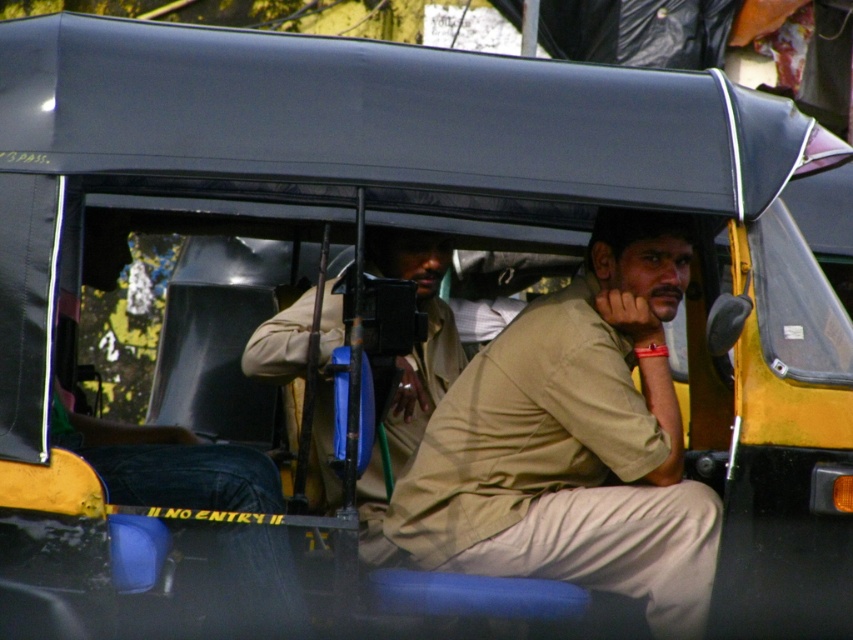
Question: Does beige cotton shirt at center have a larger size compared to khaki uniform at center?

Choices:
 (A) no
 (B) yes

Answer: (A)

Question: Which point is closer to the camera?

Choices:
 (A) (390, 547)
 (B) (608, 337)

Answer: (B)

Question: Does beige cotton shirt at center appear under khaki uniform at center?

Choices:
 (A) no
 (B) yes

Answer: (B)

Question: Which object is closer to the camera taking this photo?

Choices:
 (A) beige cotton shirt at center
 (B) khaki uniform at center

Answer: (A)

Question: Is beige cotton shirt at center wider than khaki uniform at center?

Choices:
 (A) no
 (B) yes

Answer: (B)